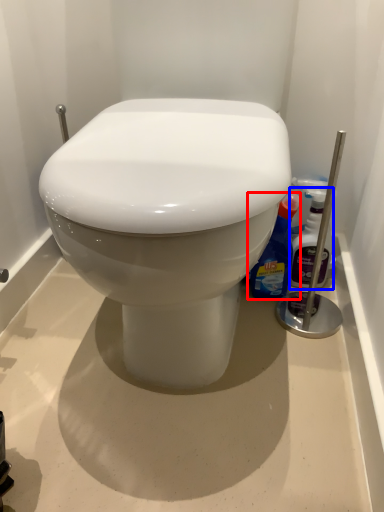
Question: Which of the following is the closest to the observer, cleaning product (highlighted by a red box) or cleaning product (highlighted by a blue box)?

Choices:
 (A) cleaning product
 (B) cleaning product

Answer: (A)